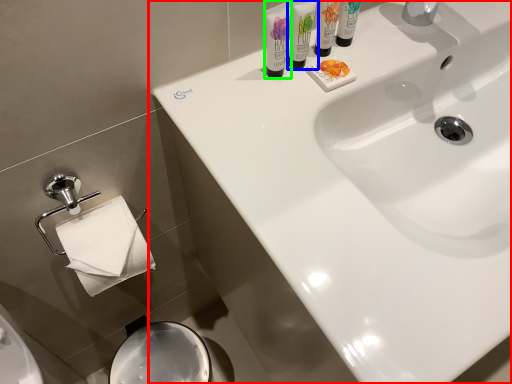
Question: Which object is the closest to the sink (highlighted by a red box)? Choose among these: shaving cream (highlighted by a blue box) or shaving cream (highlighted by a green box).

Choices:
 (A) shaving cream
 (B) shaving cream

Answer: (A)